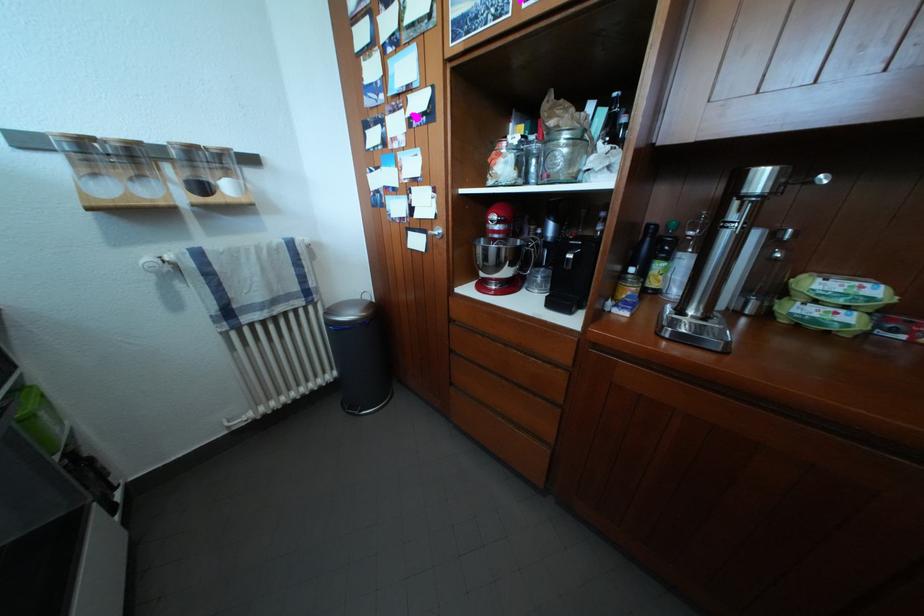
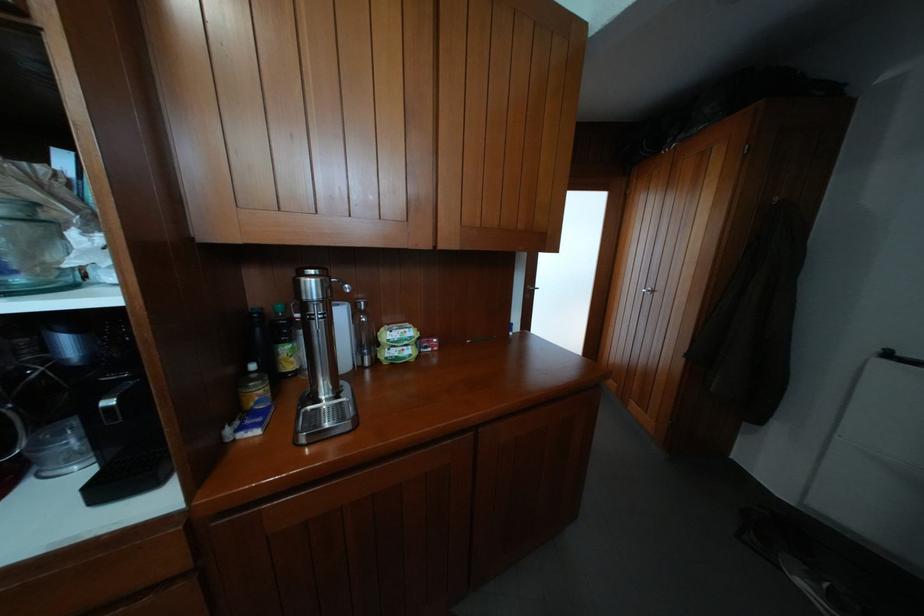
Where in the second image is the point corresponding to (x=824, y=308) from the first image?

(403, 352)